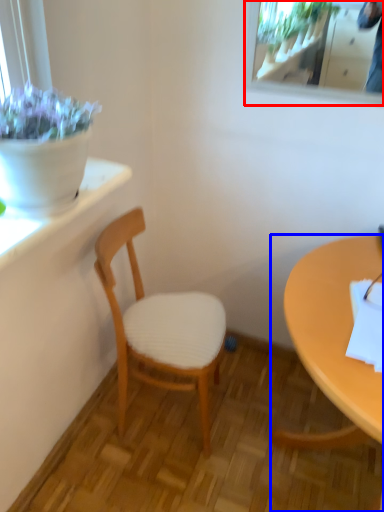
Question: Which point is closer to the camera, mirror (highlighted by a red box) or desk (highlighted by a blue box)?

Choices:
 (A) mirror
 (B) desk

Answer: (B)